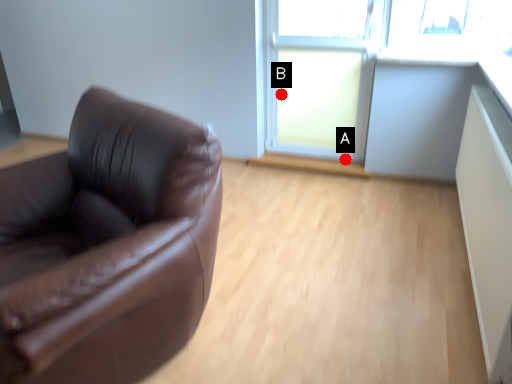
Question: Two points are circled on the image, labeled by A and B beside each circle. Which point appears closest to the camera in this image?

Choices:
 (A) A is closer
 (B) B is closer

Answer: (B)